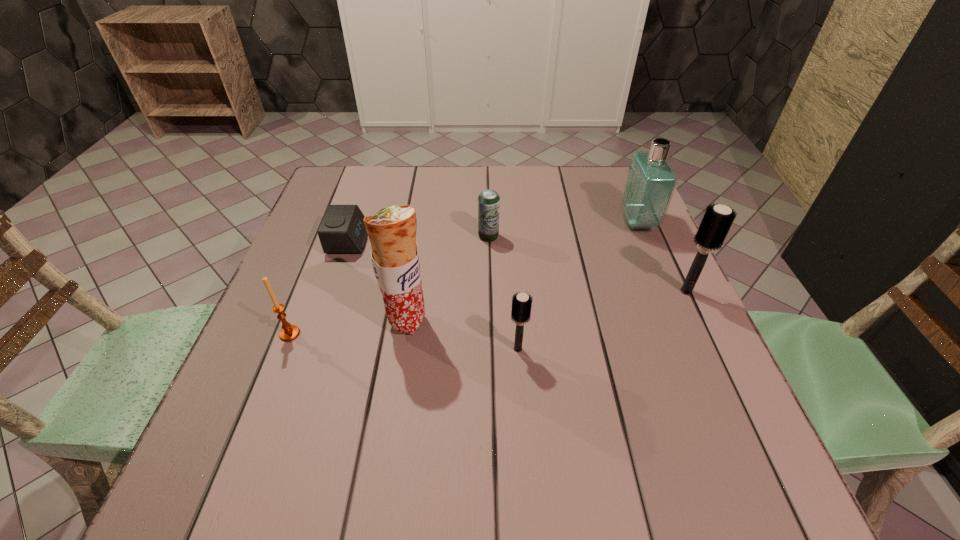
At what (x,y) coordinates should I click in order to perform the action: click on the left hairbrush. Please return your answer as a coordinate pair (x, y). The image size is (960, 540). Looking at the image, I should click on (521, 305).

Where is `the nearer hairbrush`? This screenshot has width=960, height=540. the nearer hairbrush is located at coordinates (521, 305).

Identify the location of the farther hairbrush. The width and height of the screenshot is (960, 540). (717, 220).

Locate an element on the screen. the right hairbrush is located at coordinates (717, 220).

You are a GUI agent. You are given a task and a screenshot of the screen. Output one action in this format:
    pyautogui.click(x=<x>, y=<y>)
    Task: Click on the sixth tallest object
    This screenshot has height=540, width=960.
    Given the screenshot: What is the action you would take?
    pyautogui.click(x=488, y=201)

The height and width of the screenshot is (540, 960). I want to click on the fourth object from right to left, so click(x=488, y=201).

The width and height of the screenshot is (960, 540). In order to click on the shortest object in this screenshot , I will do `click(342, 230)`.

You are a GUI agent. You are given a task and a screenshot of the screen. Output one action in this format:
    pyautogui.click(x=<x>, y=<y>)
    Task: Click on the perfume
    The height and width of the screenshot is (540, 960).
    Given the screenshot: What is the action you would take?
    pyautogui.click(x=650, y=183)

Where is `candle_holder`? candle_holder is located at coordinates (289, 332).

This screenshot has height=540, width=960. I want to click on the tallest object, so click(x=392, y=231).